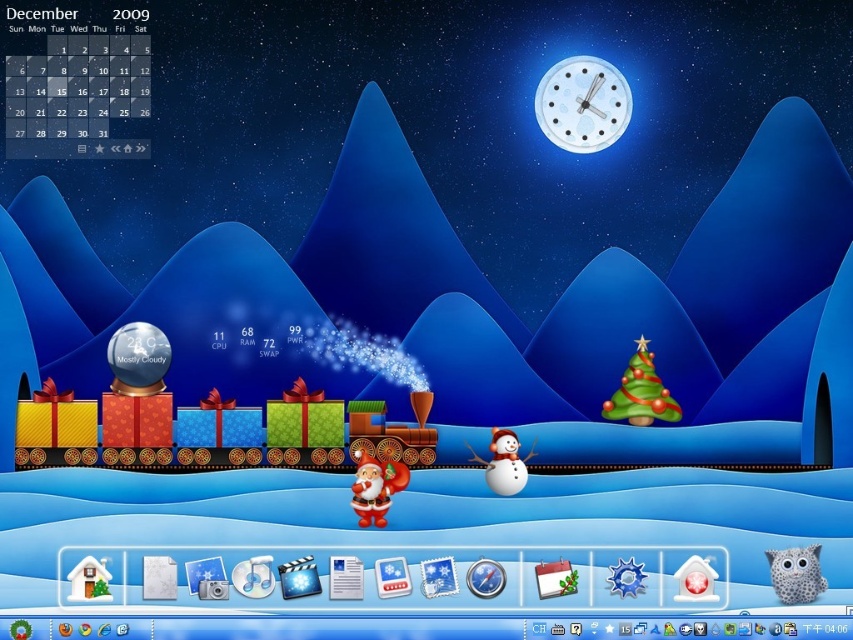
Consider the image. Who is positioned more to the left, white plastic clock at upper center or white paper calendar at bottom center?

Positioned to the left is white paper calendar at bottom center.

Between point (561, 131) and point (357, 580), which one is positioned in front?

Point (357, 580)

Find the location of a particular element. The height and width of the screenshot is (640, 853). white plastic clock at upper center is located at coordinates (582, 104).

In the scene shown: Is white matte snowman at center positioned at the back of white paper calendar at bottom center?

No, white matte snowman at center is closer to the viewer.

Does white matte snowman at center have a larger size compared to white paper calendar at bottom center?

Indeed, white matte snowman at center has a larger size compared to white paper calendar at bottom center.

Is point (524, 468) farther from viewer compared to point (347, 595)?

That is False.

You are a GUI agent. You are given a task and a screenshot of the screen. Output one action in this format:
    pyautogui.click(x=<x>, y=<y>)
    Task: Click on the white matte snowman at center
    The height and width of the screenshot is (640, 853).
    Given the screenshot: What is the action you would take?
    pyautogui.click(x=503, y=461)

Is red velvet santa at center to the right of white paper calendar at bottom center from the viewer's perspective?

Indeed, red velvet santa at center is positioned on the right side of white paper calendar at bottom center.

Does red velvet santa at center have a larger size compared to white paper calendar at bottom center?

Indeed, red velvet santa at center has a larger size compared to white paper calendar at bottom center.

Does point (397, 484) come farther from viewer compared to point (360, 580)?

No, (397, 484) is in front of (360, 580).

Find the location of `red velvet santa at center`. red velvet santa at center is located at coordinates (375, 486).